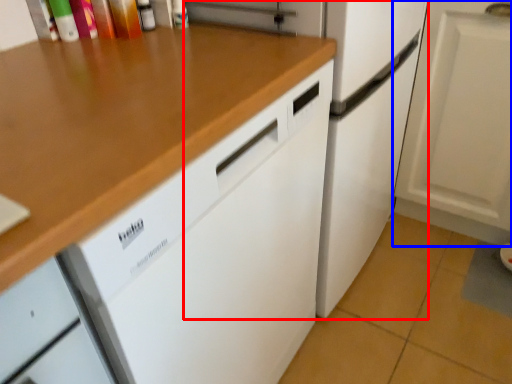
Question: Which of the following is the closest to the observer, refrigerator (highlighted by a red box) or cabinetry (highlighted by a blue box)?

Choices:
 (A) refrigerator
 (B) cabinetry

Answer: (A)